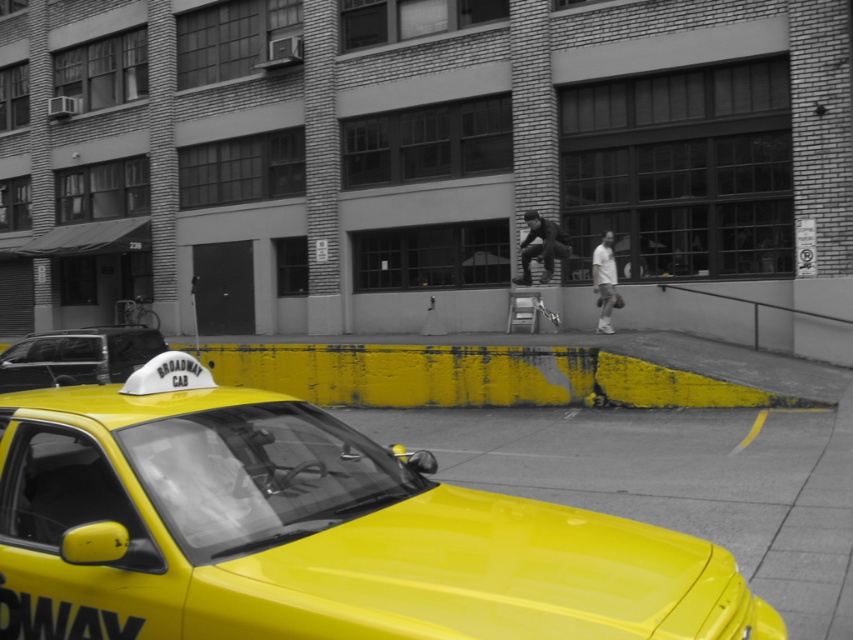
Question: Which point is farther to the camera?

Choices:
 (A) (544, 230)
 (B) (596, 260)

Answer: (A)

Question: Among these points, which one is farthest from the camera?

Choices:
 (A) (596, 321)
 (B) (318, 499)
 (C) (7, 348)
 (D) (549, 220)

Answer: (C)

Question: Which point is farther from the camera taking this photo?

Choices:
 (A) (456, 625)
 (B) (610, 275)
 (C) (106, 372)

Answer: (B)

Question: Does yellow plastic taxi cab at lower left have a greater width compared to dark gray fabric pants at center?

Choices:
 (A) no
 (B) yes

Answer: (B)

Question: Is yellow plastic taxi cab at lower left smaller than dark gray fabric pants at center?

Choices:
 (A) no
 (B) yes

Answer: (A)

Question: Does shiny yellow taxi at lower left have a greater width compared to white matte shirt at center?

Choices:
 (A) no
 (B) yes

Answer: (B)